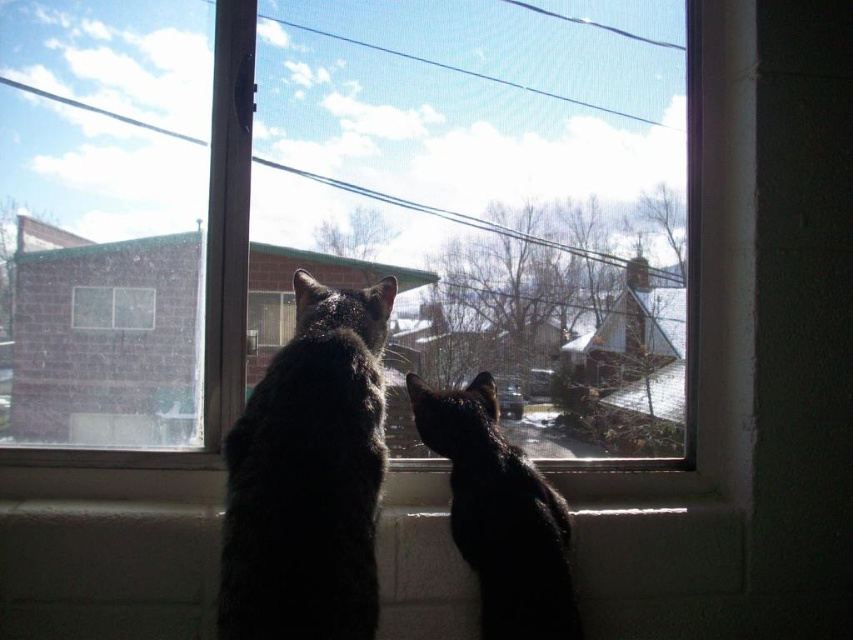
You are standing in a room and want to look outside through the transparent glass window at center. Where should you position yourself to see the entire window frame?

The transparent glass window at center is located at point (346, 214), so you should position yourself directly in front of that coordinate to see the entire window frame.

You are a photographer trying to capture both cats in a single shot. Since the window is slightly open, you notice that the dark fur cat at center and the black glossy cat at center are positioned in a way that might block each other. Based on their positions, which cat should you focus on first to ensure both are in the frame?

The dark fur cat at center is to the left of the black glossy cat at center, so you should focus on the dark fur cat at center first to ensure both are in the frame without one blocking the other.